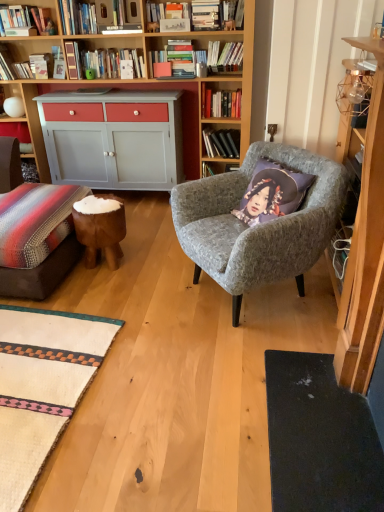
Question: Is hardcover books at upper center, arranged as the 4th book when viewed from the front, not inside wooden bookshelf at upper left, arranged as the second shelf when viewed from the back?

Choices:
 (A) no
 (B) yes

Answer: (B)

Question: Is hardcover books at upper center, which ranks as the second book in bottom-to-top order, thinner than wooden bookshelf at upper left, the 1th shelf in the top-to-bottom sequence?

Choices:
 (A) no
 (B) yes

Answer: (A)

Question: Is hardcover books at upper center, which ranks as the first book in back-to-front order, bigger than wooden bookshelf at upper left, which is the second shelf from bottom to top?

Choices:
 (A) yes
 (B) no

Answer: (A)

Question: Does hardcover books at upper center, arranged as the 4th book when viewed from the front, have a smaller size compared to wooden bookshelf at upper left, the 1th shelf in the top-to-bottom sequence?

Choices:
 (A) yes
 (B) no

Answer: (B)

Question: Does hardcover books at upper center, which is the 3th book from top to bottom, have a greater height compared to wooden bookshelf at upper left, arranged as the first shelf when viewed from the front?

Choices:
 (A) no
 (B) yes

Answer: (B)

Question: Considering the positions of point (367, 123) and point (231, 99), is point (367, 123) closer or farther from the camera than point (231, 99)?

Choices:
 (A) farther
 (B) closer

Answer: (B)

Question: From a real-world perspective, is metallic gold cabinet at upper right above or below hardcover book at upper center, the 2th book from the top?

Choices:
 (A) above
 (B) below

Answer: (B)

Question: Is metallic gold cabinet at upper right to the left or to the right of hardcover book at upper center, the third book in the right-to-left sequence, in the image?

Choices:
 (A) left
 (B) right

Answer: (B)

Question: From the image's perspective, is metallic gold cabinet at upper right above or below hardcover book at upper center, the 2th book from the top?

Choices:
 (A) above
 (B) below

Answer: (B)

Question: Considering their positions, is brown wooden stool at lower left located in front of or behind metallic gold cabinet at upper right?

Choices:
 (A) behind
 (B) front

Answer: (A)

Question: From a real-world perspective, is brown wooden stool at lower left above or below metallic gold cabinet at upper right?

Choices:
 (A) above
 (B) below

Answer: (B)

Question: Considering the positions of brown wooden stool at lower left and metallic gold cabinet at upper right in the image, is brown wooden stool at lower left bigger or smaller than metallic gold cabinet at upper right?

Choices:
 (A) big
 (B) small

Answer: (B)

Question: Is brown wooden stool at lower left wider or thinner than metallic gold cabinet at upper right?

Choices:
 (A) wide
 (B) thin

Answer: (A)

Question: Is hardcover book at upper center, which is the 2th book in back-to-front order, spatially inside wooden bookshelf at upper left, arranged as the first shelf when viewed from the front, or outside of it?

Choices:
 (A) inside
 (B) outside

Answer: (B)

Question: From the image's perspective, relative to wooden bookshelf at upper left, the 1th shelf in the top-to-bottom sequence, is hardcover book at upper center, which is the 2th book in back-to-front order, above or below?

Choices:
 (A) above
 (B) below

Answer: (B)